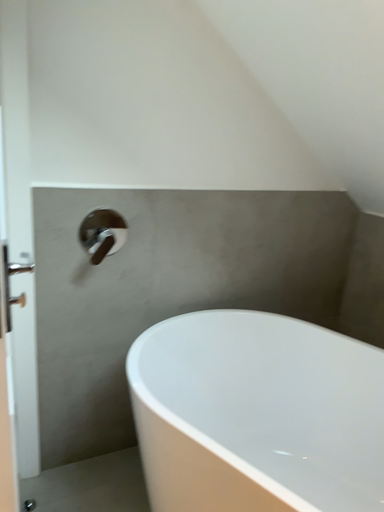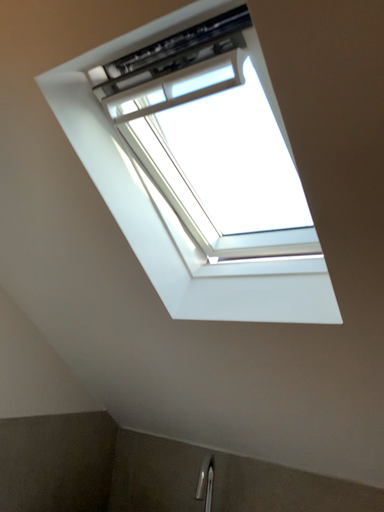
Question: Which way did the camera rotate in the video?

Choices:
 (A) rotated downward
 (B) rotated upward

Answer: (B)